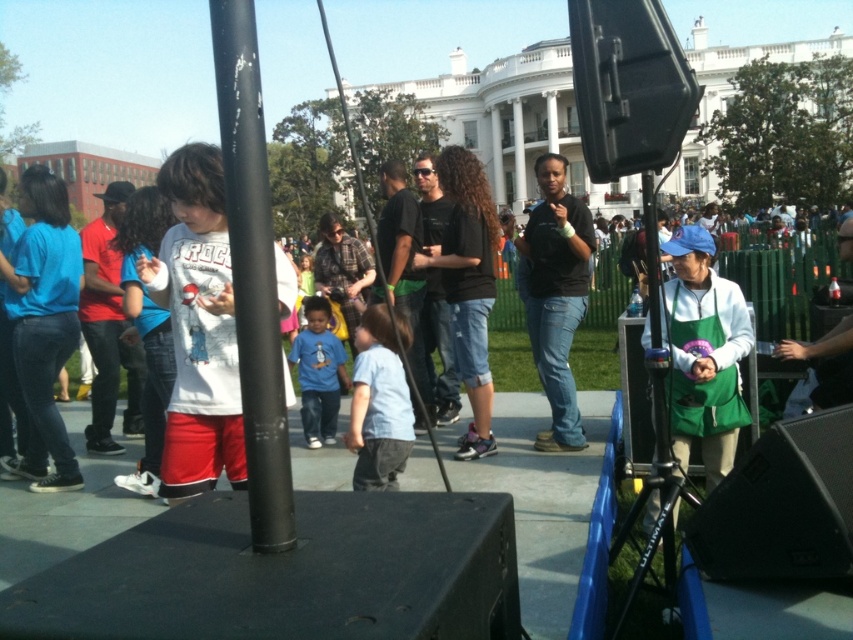
You are standing at the front of the stage and want to walk to the nearest point between point (248, 150) and point (421, 188). Which point should you walk towards?

You should walk towards point (248, 150) because it is closer to you than point (421, 188).

You are organizing a safety check for the event and need to ensure that the black matte pole at center and the matte black shirt at center are within a 20 meter safety zone. Based on the scene description, are they within the required distance?

The distance between the black matte pole at center and the matte black shirt at center is 19.76 meters, which is within the 20 meter safety zone requirement.